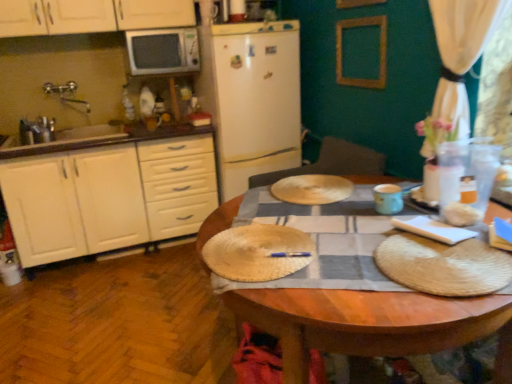
You are a GUI agent. You are given a task and a screenshot of the screen. Output one action in this format:
    pyautogui.click(x=<x>, y=<y>)
    Task: Click on the vacant area situated to the left side of matte blue cup at center right
    The image size is (512, 384).
    Given the screenshot: What is the action you would take?
    pyautogui.click(x=349, y=214)